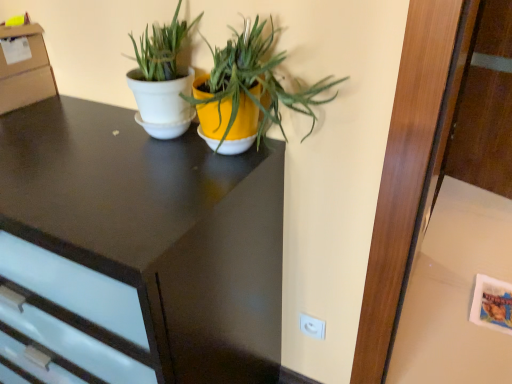
Find the location of `vacant area that is in front of white glossy pot at center, which is the second houseplant in left-to-right order`. vacant area that is in front of white glossy pot at center, which is the second houseplant in left-to-right order is located at coordinates (179, 197).